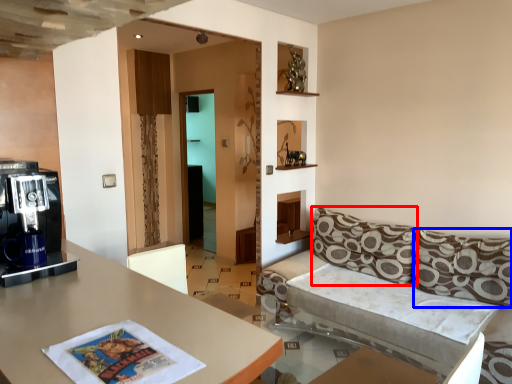
Question: Which of the following is the closest to the observer, pillow (highlighted by a red box) or pillow (highlighted by a blue box)?

Choices:
 (A) pillow
 (B) pillow

Answer: (B)